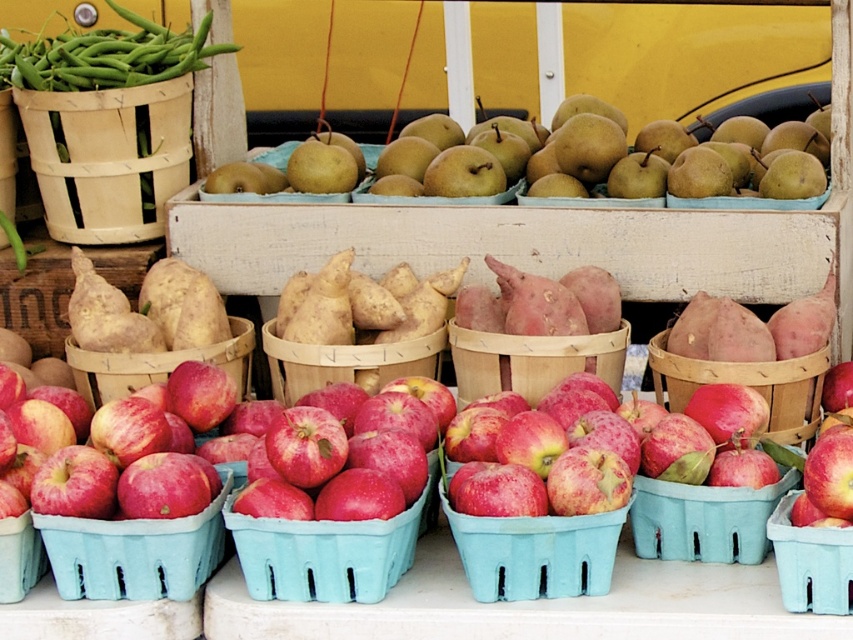
Question: Does smooth brown basket at center have a greater width compared to matte plastic apples at lower right?

Choices:
 (A) no
 (B) yes

Answer: (B)

Question: Is shiny red apples at center smaller than matte plastic basket at center?

Choices:
 (A) yes
 (B) no

Answer: (B)

Question: Among these objects, which one is nearest to the camera?

Choices:
 (A) matte brown basket of potatoes at center
 (B) green matte beans at upper left
 (C) natural wood basket at center-left
 (D) natural brown basket at center

Answer: (D)

Question: Does shiny red apple at center appear on the right side of matte plastic apples at center?

Choices:
 (A) no
 (B) yes

Answer: (A)

Question: Which point appears closest to the camera in this image?

Choices:
 (A) (274, 324)
 (B) (253, 592)
 (C) (837, 561)

Answer: (C)

Question: Which point is farther to the camera?

Choices:
 (A) (225, 371)
 (B) (236, 516)
 (C) (183, 65)

Answer: (C)